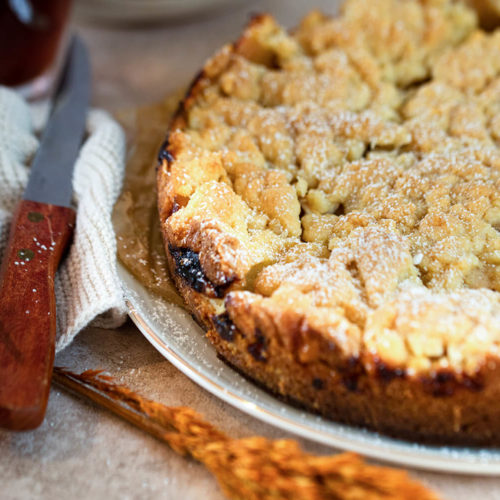
Locate an element on the screen. plate is located at coordinates (196, 357).